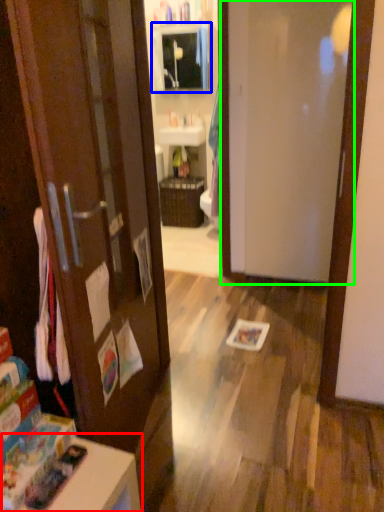
Question: Based on their relative distances, which object is nearer to table (highlighted by a red box)? Choose from medicine cabinet (highlighted by a blue box) and door (highlighted by a green box).

Choices:
 (A) medicine cabinet
 (B) door

Answer: (B)